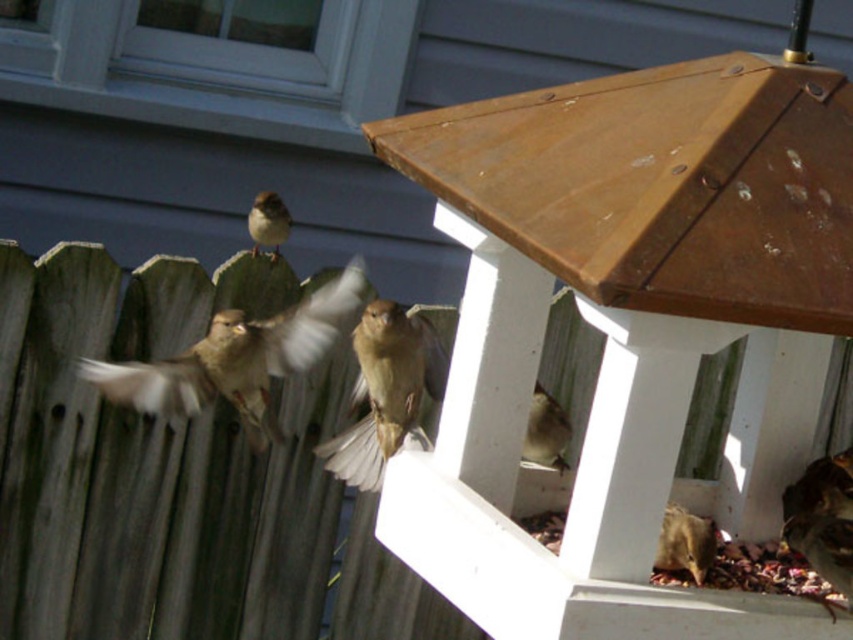
You are standing in the backyard looking at the bird feeder. Which bird, the brown matte bird at center or the brown matte bird at lower center, is closer to you?

The brown matte bird at center is closer to you because it is further to the viewer than the brown matte bird at lower center.

Based on the photo, you are a birdwatcher observing the birds in the backyard. You see the brown matte bird at lower center and the brown feathered bird at upper center. Which bird is positioned higher in the image?

The brown feathered bird at upper center is positioned higher than the brown matte bird at lower center.

Based on the photo, you are a birdwatcher trying to identify the sizes of birds in the image. Which of the two birds, the brown matte bird at center or the brown matte bird at lower center, is larger?

The brown matte bird at center is bigger than the brown matte bird at lower center.